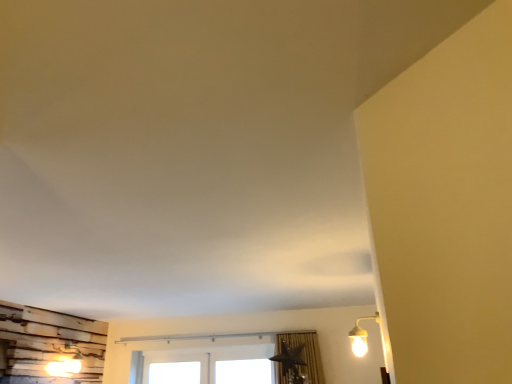
Describe the element at coordinates (361, 336) in the screenshot. The image size is (512, 384). I see `matte yellow lamp at upper right` at that location.

Where is `matte yellow lamp at upper right`? The image size is (512, 384). matte yellow lamp at upper right is located at coordinates (361, 336).

This screenshot has width=512, height=384. Identify the location of matte yellow lamp at upper right. (361, 336).